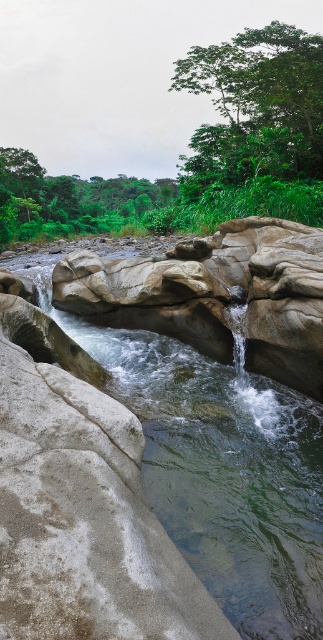
Question: Is green leafy tree at upper right bigger than green leafy tree at upper left?

Choices:
 (A) no
 (B) yes

Answer: (A)

Question: Observing the image, what is the correct spatial positioning of green leafy tree at upper right in reference to green leafy tree at upper left?

Choices:
 (A) right
 (B) left

Answer: (A)

Question: Which point appears farthest from the camera in this image?

Choices:
 (A) coord(212,164)
 (B) coord(14,225)

Answer: (B)

Question: Does green leafy tree at upper right appear over green leafy tree at upper left?

Choices:
 (A) yes
 (B) no

Answer: (B)

Question: Among these points, which one is farthest from the camera?

Choices:
 (A) (284, 74)
 (B) (51, 193)

Answer: (B)